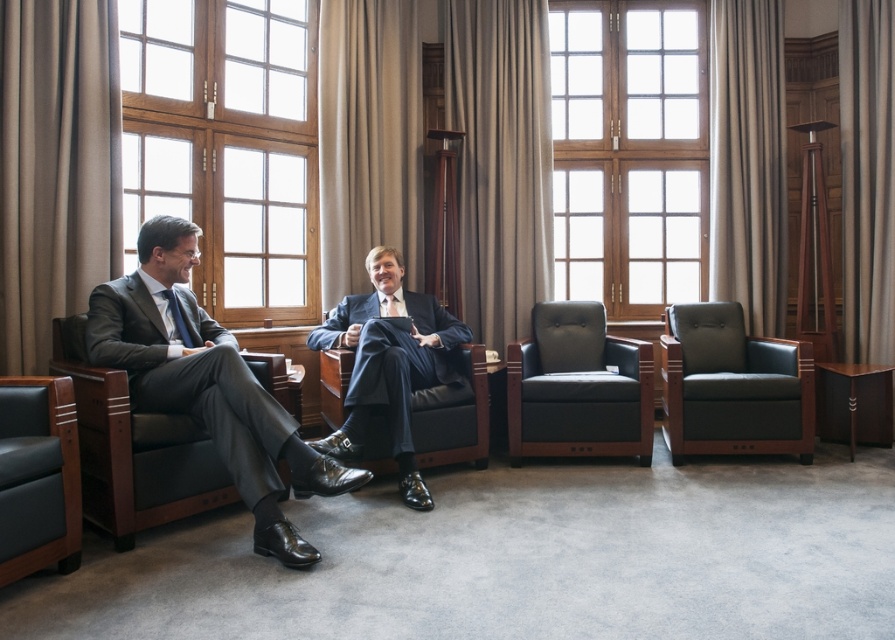
You are a decorator planning to hang a new curtain rod between the brown fabric curtain at left and the beige fabric curtain at center. Which curtain requires a shorter rod based on their heights?

The brown fabric curtain at left has a lesser height compared to the beige fabric curtain at center, so it requires a shorter rod.

What object is located at the coordinates point (x=629, y=152) in the image?

The point (x=629, y=152) corresponds to the wooden frame at center.